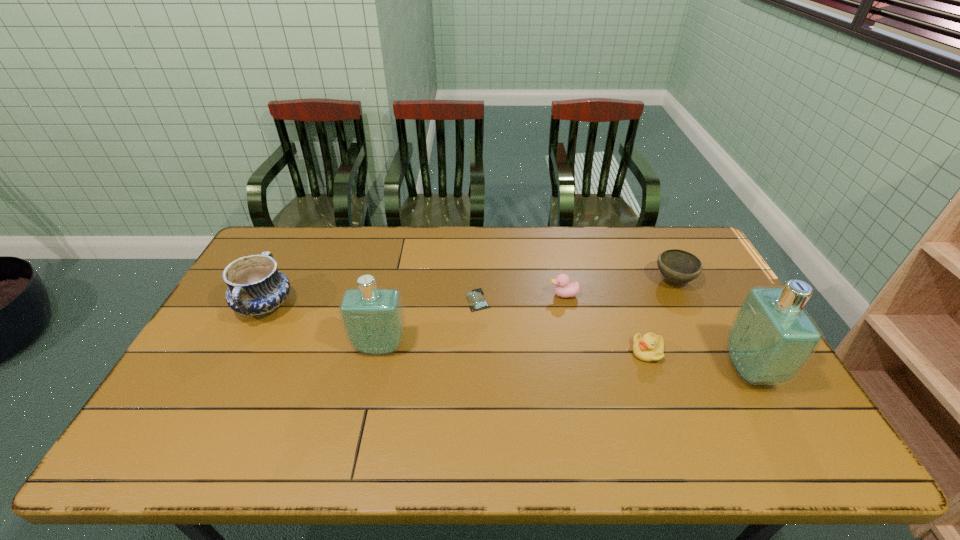
I want to click on vacant space located on the front-facing side of the farther duckling, so click(516, 295).

Identify the location of blank space located on the front-facing side of the farther duckling. Image resolution: width=960 pixels, height=540 pixels. (481, 295).

The image size is (960, 540). I want to click on free space located 0.290m on the front-facing side of the farther duckling, so click(459, 295).

Locate an element on the screen. This screenshot has width=960, height=540. free region located 0.270m on the beak of the third object from right to left is located at coordinates coord(535,352).

I want to click on vacant region located 0.300m on the beak of the third object from right to left, so click(x=524, y=352).

What are the coordinates of `free space located 0.120m on the beak of the third object from right to left` in the screenshot? It's located at (588, 352).

Identify the location of object positioned at the far edge. (677, 266).

The image size is (960, 540). Identify the location of object located in the near edge section of the desktop. (771, 338).

Locate an element on the screen. This screenshot has height=540, width=960. object that is at the left edge is located at coordinates (256, 288).

Where is `perfume present at the right edge`? perfume present at the right edge is located at coordinates (771, 338).